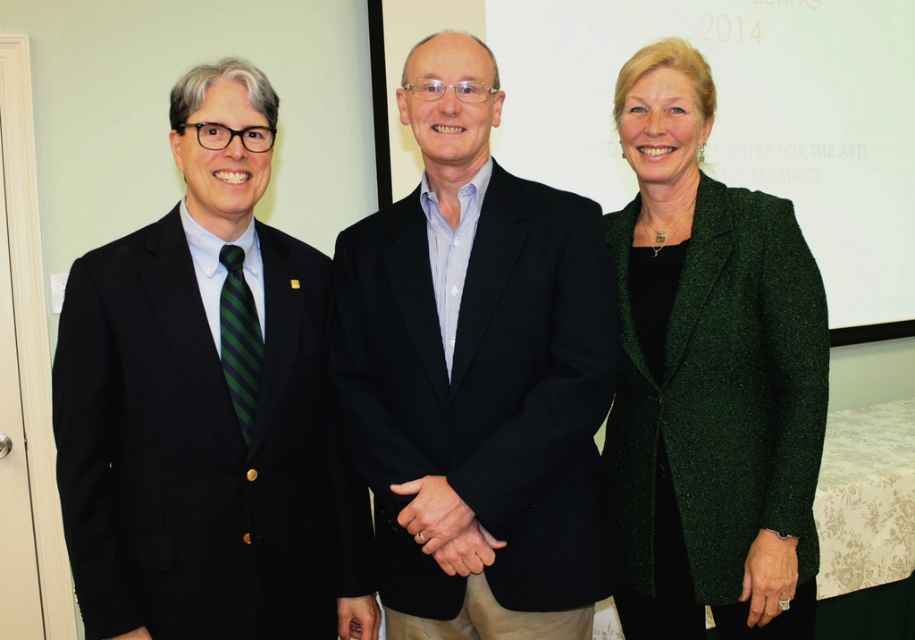
You are standing in the room and want to know the exact position of the matte black suit at left. Can you determine its coordinates based on the image?

The matte black suit at left is located at point coordinates of (205, 404).

Based on the scene description, which individual has a wider torso measurement between the matte black suit at left and the green textured blazer at center?

The matte black suit at left has a wider torso measurement than the green textured blazer at center because the matte black suit at left is wider in width according to the description.